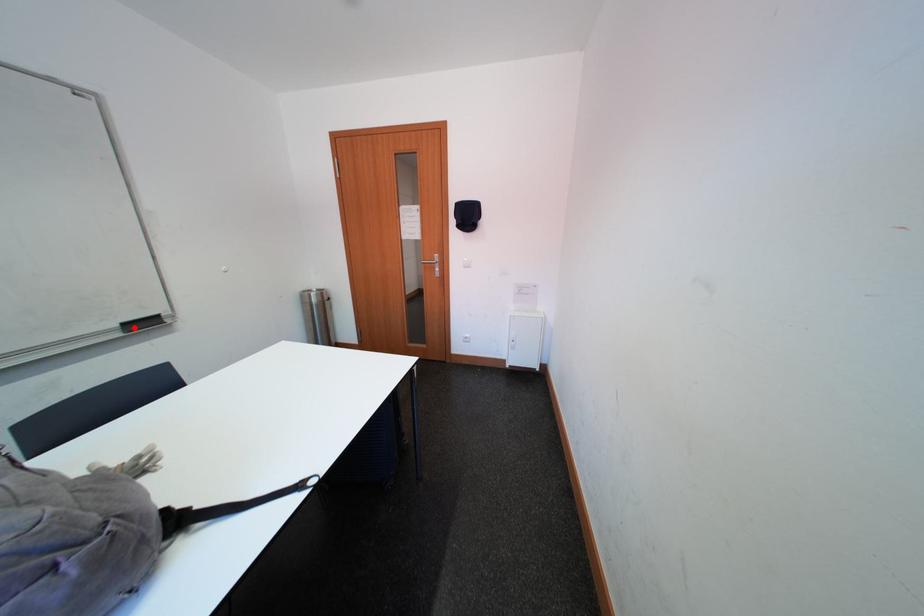
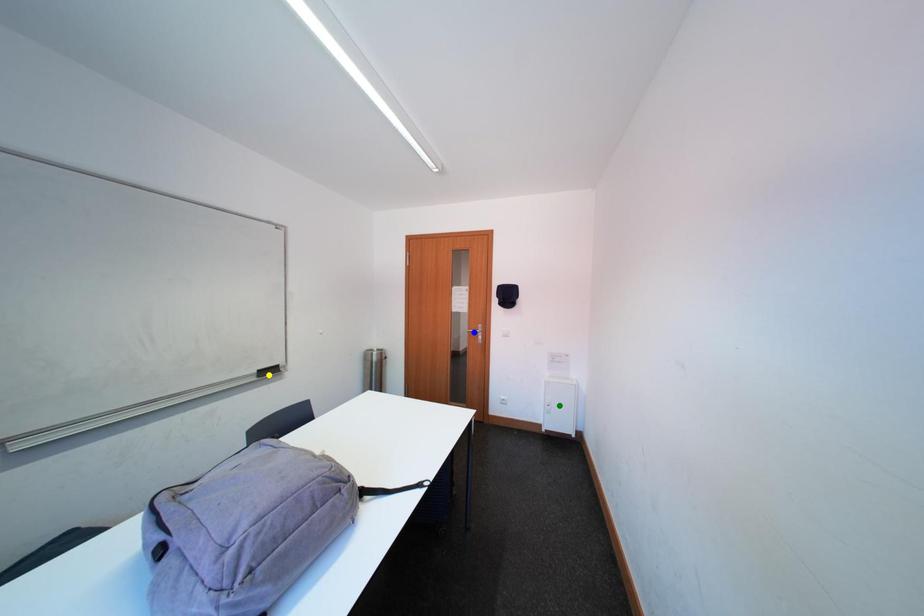
Question: I am providing you with two images of the same scene from different viewpoints. A red point is marked on the first image. You are given multiple points on the second image. Can you choose the point in image 2 that corresponds to the point in image 1?

Choices:
 (A) green point
 (B) yellow point
 (C) blue point

Answer: (B)